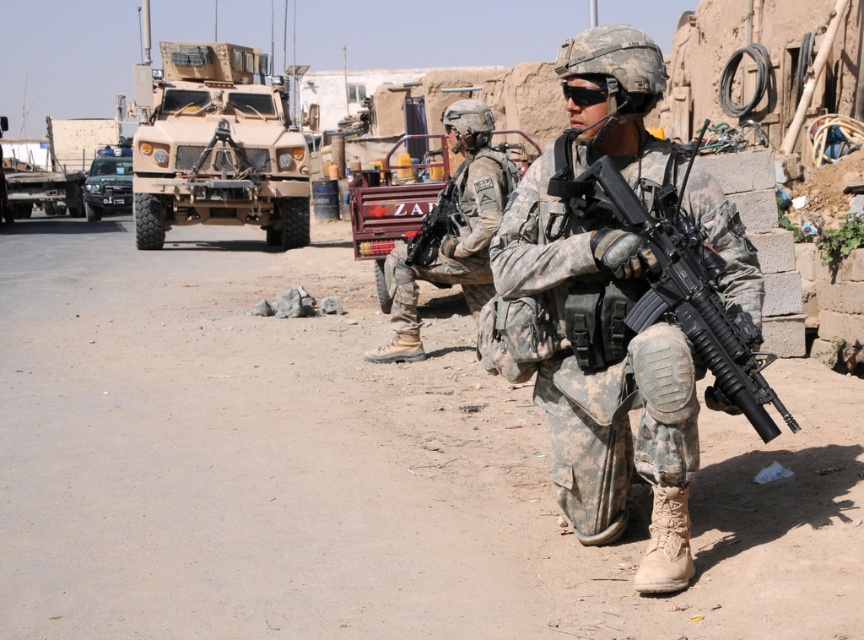
Does matte tan military vehicle at upper left have a greater width compared to camouflage fabric uniform at center?

Yes, matte tan military vehicle at upper left is wider than camouflage fabric uniform at center.

Locate an element on the screen. Image resolution: width=864 pixels, height=640 pixels. matte tan military vehicle at upper left is located at coordinates (216, 147).

Does camouflage fabric uniform at center have a lesser height compared to dark green matte truck at left?

Correct, camouflage fabric uniform at center is not as tall as dark green matte truck at left.

Is point (469, 236) more distant than point (119, 192)?

No.

Where is `camouflage fabric uniform at center`? camouflage fabric uniform at center is located at coordinates (450, 230).

You are a GUI agent. You are given a task and a screenshot of the screen. Output one action in this format:
    pyautogui.click(x=<x>, y=<y>)
    Task: Click on the camouflage fabric uniform at center
    The height and width of the screenshot is (640, 864).
    Given the screenshot: What is the action you would take?
    pyautogui.click(x=450, y=230)

Is matte tan military vehicle at upper left to the right of black matte rifle at center from the viewer's perspective?

In fact, matte tan military vehicle at upper left is to the left of black matte rifle at center.

What do you see at coordinates (216, 147) in the screenshot? I see `matte tan military vehicle at upper left` at bounding box center [216, 147].

Where is `matte tan military vehicle at upper left`? The image size is (864, 640). matte tan military vehicle at upper left is located at coordinates (216, 147).